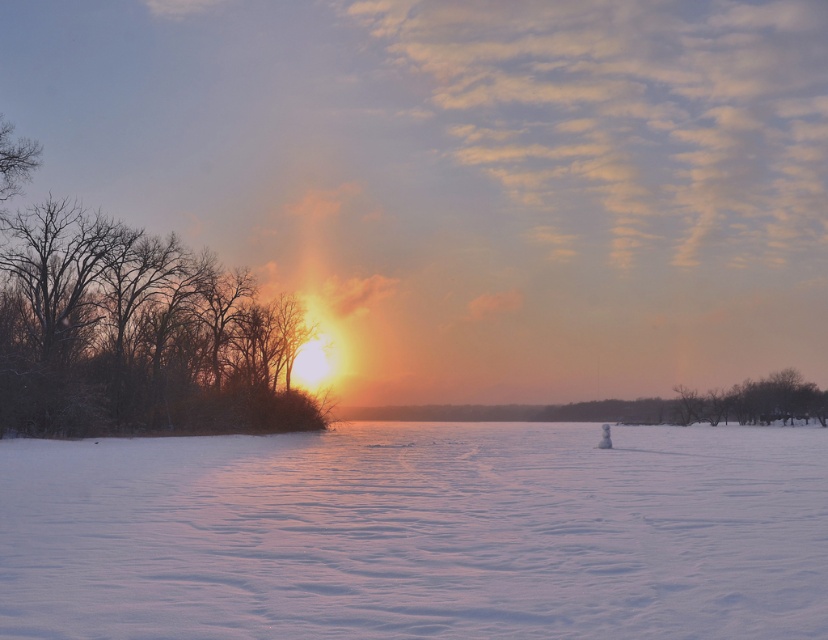
Does white matte snow at center have a smaller size compared to snow-covered trees at left?

Indeed, white matte snow at center has a smaller size compared to snow-covered trees at left.

Does point (578, 584) come closer to viewer compared to point (234, 285)?

Yes, it is in front of point (234, 285).

Find the location of a particular element. white matte snow at center is located at coordinates (417, 532).

Based on the photo, can you confirm if white matte snow at center is shorter than smooth brown tree at right?

Yes.

Does white matte snow at center have a greater width compared to smooth brown tree at right?

Yes, white matte snow at center is wider than smooth brown tree at right.

Does point (710, 442) come closer to viewer compared to point (728, 392)?

Yes, it is.

Locate an element on the screen. Image resolution: width=828 pixels, height=640 pixels. white matte snow at center is located at coordinates (417, 532).

Between snow-covered trees at left and smooth brown tree at right, which one is positioned higher?

snow-covered trees at left is higher up.

Is point (188, 419) positioned after point (734, 404)?

No, (188, 419) is in front of (734, 404).

The width and height of the screenshot is (828, 640). In order to click on snow-covered trees at left in this screenshot , I will do `click(137, 333)`.